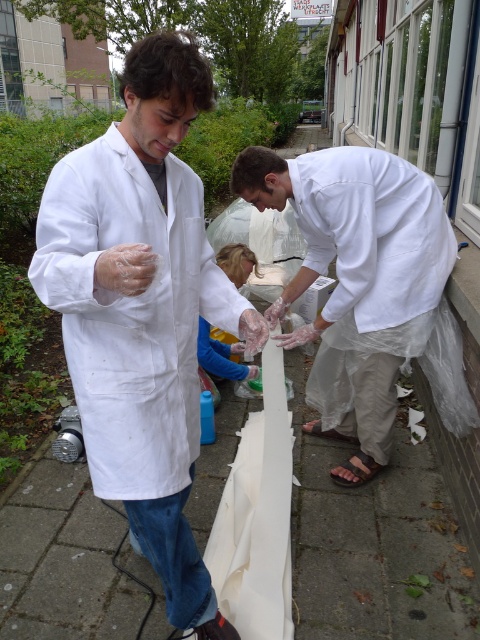
Question: Observing the image, what is the correct spatial positioning of white matte lab coat at center in reference to white matte lab coat at right?

Choices:
 (A) above
 (B) below

Answer: (B)

Question: Can you confirm if white matte lab coat at center is positioned to the right of white matte lab coat at right?

Choices:
 (A) no
 (B) yes

Answer: (A)

Question: Where is white matte lab coat at center located in relation to white matte lab coat at right in the image?

Choices:
 (A) left
 (B) right

Answer: (A)